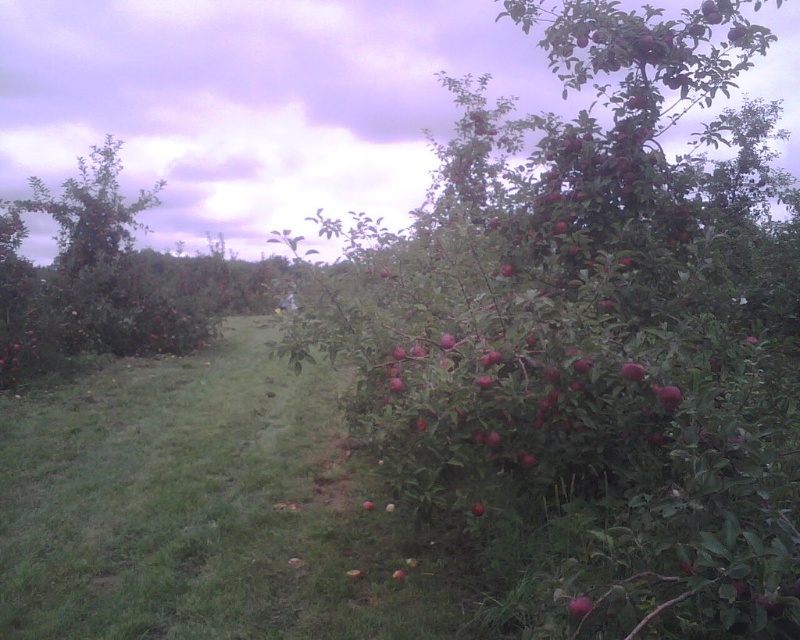
Can you confirm if green grass at center is positioned to the right of red matte apple at center-right?

No, green grass at center is not to the right of red matte apple at center-right.

Who is more distant from viewer, (x=404, y=608) or (x=678, y=401)?

Point (x=404, y=608)

Where is `green grass at center`? green grass at center is located at coordinates (206, 509).

Which is behind, point (584, 611) or point (630, 378)?

The point (630, 378) is more distant.

Is point (582, 596) farther from viewer compared to point (620, 371)?

That is False.

Locate an element on the screen. The width and height of the screenshot is (800, 640). shiny red apple at lower right is located at coordinates (580, 605).

Image resolution: width=800 pixels, height=640 pixels. Find the location of `green grass at center`. green grass at center is located at coordinates (206, 509).

Between green grass at center and shiny red apple at center right, which one is positioned lower?

green grass at center is lower down.

Find the location of a particular element. Image resolution: width=800 pixels, height=640 pixels. green grass at center is located at coordinates (206, 509).